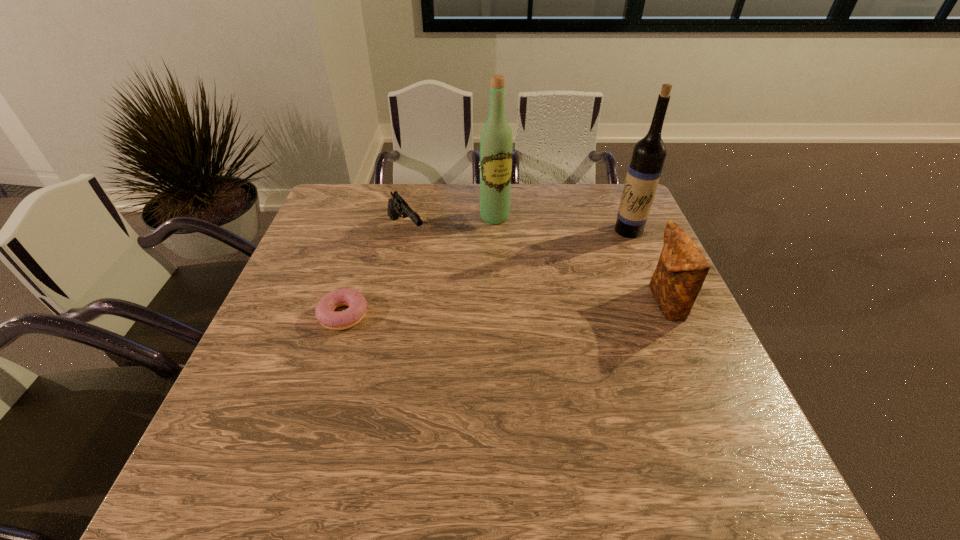
You are a GUI agent. You are given a task and a screenshot of the screen. Output one action in this format:
    pyautogui.click(x=<x>, y=<y>)
    Task: Click on the blank region between the right wine bottle and the third object from left to right
    
    Given the screenshot: What is the action you would take?
    pyautogui.click(x=562, y=224)

At what (x,y) coordinates should I click in order to perform the action: click on vacant space that's between the right wine bottle and the clutch bag. Please return your answer as a coordinate pair (x, y). This screenshot has width=960, height=540. Looking at the image, I should click on (647, 267).

Identify the location of free space between the shortest object and the fourth tallest object. This screenshot has height=540, width=960. (374, 273).

Image resolution: width=960 pixels, height=540 pixels. I want to click on free space between the second shortest object and the right wine bottle, so click(517, 231).

Find the location of `vacant point located between the right wine bottle and the doughnut`. vacant point located between the right wine bottle and the doughnut is located at coordinates (486, 273).

You are a GUI agent. You are given a task and a screenshot of the screen. Output one action in this format:
    pyautogui.click(x=<x>, y=<y>)
    Task: Click on the free space between the gun and the right wine bottle
    
    Given the screenshot: What is the action you would take?
    pyautogui.click(x=517, y=231)

The width and height of the screenshot is (960, 540). Find the location of `vacant area between the fourth tallest object and the doughnut`. vacant area between the fourth tallest object and the doughnut is located at coordinates (374, 273).

This screenshot has height=540, width=960. What are the coordinates of `free point between the clutch bag and the doughnut` in the screenshot? It's located at (504, 309).

You are a GUI agent. You are given a task and a screenshot of the screen. Output one action in this format:
    pyautogui.click(x=<x>, y=<y>)
    Task: Click on the blank region between the right wine bottle and the gun
    
    Given the screenshot: What is the action you would take?
    pyautogui.click(x=517, y=231)

Where is `object that is the closest to the third tallest object`? object that is the closest to the third tallest object is located at coordinates (648, 156).